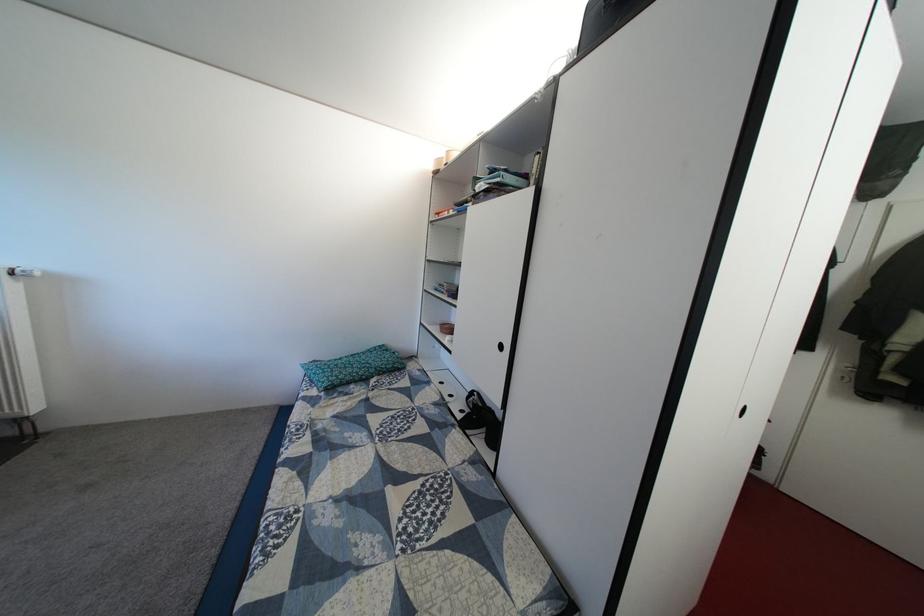
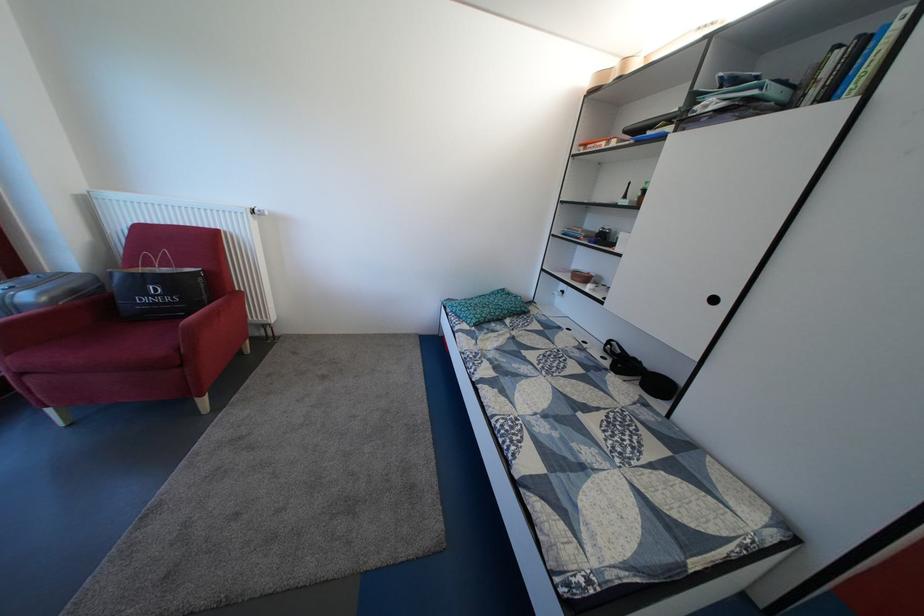
Find the pixel in the second image that matches point (447, 331) in the first image.

(570, 278)